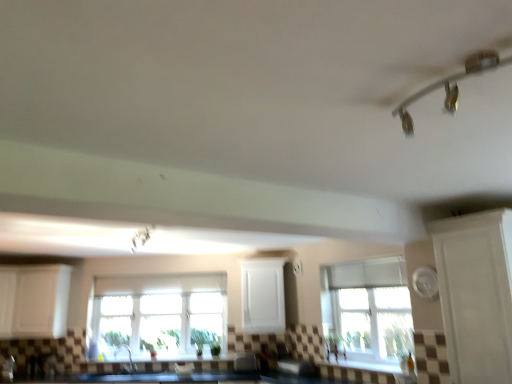
Question: From a real-world perspective, is silver metallic faucet at lower left physically above clear glass window at center, the first window viewed from the back?

Choices:
 (A) no
 (B) yes

Answer: (A)

Question: Is silver metallic faucet at lower left facing towards clear glass window at center, which is the 2th window from right to left?

Choices:
 (A) yes
 (B) no

Answer: (B)

Question: From a real-world perspective, is silver metallic faucet at lower left located beneath clear glass window at center, placed as the first window when sorted from left to right?

Choices:
 (A) no
 (B) yes

Answer: (B)

Question: From the image's perspective, is silver metallic faucet at lower left on top of clear glass window at center, which is the 2th window from right to left?

Choices:
 (A) yes
 (B) no

Answer: (B)

Question: Is silver metallic faucet at lower left positioned beyond the bounds of clear glass window at center, the 2th window when ordered from front to back?

Choices:
 (A) yes
 (B) no

Answer: (A)

Question: Is clear glass window at center, which is the 2th window from right to left, a part of silver metallic faucet at lower left?

Choices:
 (A) yes
 (B) no

Answer: (B)

Question: From a real-world perspective, is white glossy cabinet at right physically above metallic white light fixture at upper center, which ranks as the 2th light fixture in right-to-left order?

Choices:
 (A) yes
 (B) no

Answer: (B)

Question: Considering the relative sizes of white glossy cabinet at right and metallic white light fixture at upper center, placed as the second light fixture when sorted from front to back, in the image provided, is white glossy cabinet at right smaller than metallic white light fixture at upper center, placed as the second light fixture when sorted from front to back,?

Choices:
 (A) yes
 (B) no

Answer: (B)

Question: Can you confirm if white glossy cabinet at right is bigger than metallic white light fixture at upper center, which ranks as the 2th light fixture in right-to-left order?

Choices:
 (A) no
 (B) yes

Answer: (B)

Question: Considering the relative sizes of white glossy cabinet at right and metallic white light fixture at upper center, which ranks as the 2th light fixture in right-to-left order, in the image provided, is white glossy cabinet at right wider than metallic white light fixture at upper center, which ranks as the 2th light fixture in right-to-left order,?

Choices:
 (A) yes
 (B) no

Answer: (B)

Question: Is metallic white light fixture at upper center, arranged as the first light fixture when ordered from the bottom, located within white glossy cabinet at right?

Choices:
 (A) no
 (B) yes

Answer: (A)

Question: Is white glossy cabinet at right placed right next to metallic white light fixture at upper center, which ranks as the 2th light fixture in right-to-left order?

Choices:
 (A) yes
 (B) no

Answer: (B)

Question: Is white matte cabinet at left, which is the 2th cabinetry in right-to-left order, with metallic white light fixture at upper center, acting as the 1th light fixture starting from the back?

Choices:
 (A) yes
 (B) no

Answer: (B)